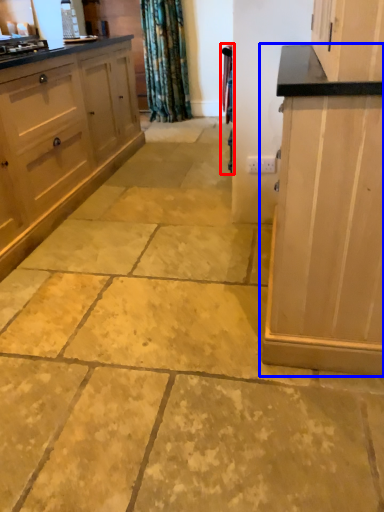
Question: Which of the following is the closest to the observer, curtain (highlighted by a red box) or cabinetry (highlighted by a blue box)?

Choices:
 (A) curtain
 (B) cabinetry

Answer: (B)